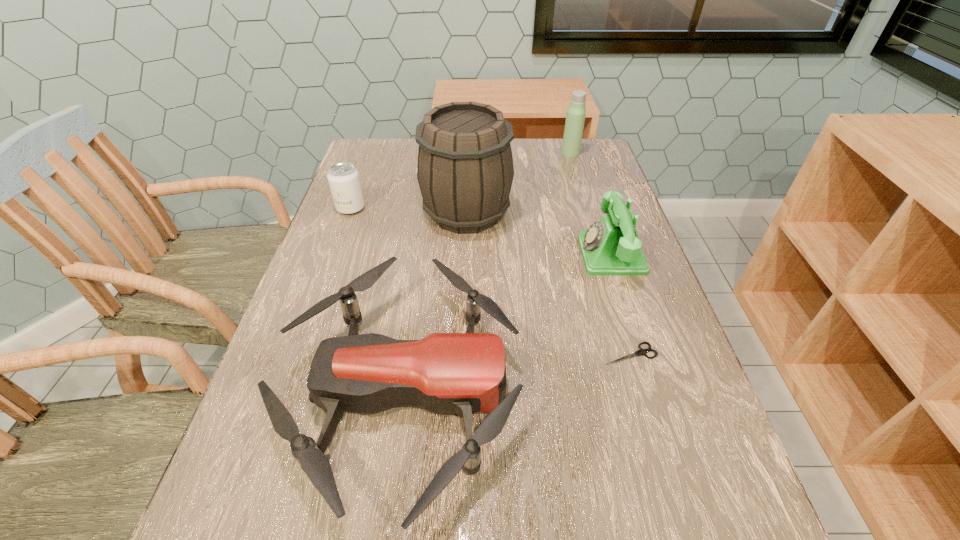
Locate an element on the screen. This screenshot has width=960, height=540. wine bucket is located at coordinates (465, 171).

Where is `the fifth shortest object`? This screenshot has height=540, width=960. the fifth shortest object is located at coordinates (575, 117).

The image size is (960, 540). In order to click on thermos bottle in this screenshot , I will do `click(575, 117)`.

At what (x,y) coordinates should I click in order to perform the action: click on telephone. Please return your answer as a coordinate pair (x, y). Image resolution: width=960 pixels, height=540 pixels. Looking at the image, I should click on (610, 246).

Where is `soda can`? Image resolution: width=960 pixels, height=540 pixels. soda can is located at coordinates (344, 181).

At what (x,y) coordinates should I click in order to perform the action: click on the shortest object. Please return your answer as a coordinate pair (x, y). The height and width of the screenshot is (540, 960). Looking at the image, I should click on pos(641,351).

Find the location of a particular element. The image size is (960, 540). free space located on the back of the wine bucket is located at coordinates (468, 161).

The height and width of the screenshot is (540, 960). Identify the location of vacant space situated on the left of the farthest object. click(511, 153).

This screenshot has width=960, height=540. In order to click on vacant space located on the dial of the telephone in this screenshot , I will do pos(433,255).

You are a GUI agent. You are given a task and a screenshot of the screen. Output one action in this format:
    pyautogui.click(x=<x>, y=<y>)
    Task: Click on the free space located on the dial of the telephone
    The image size is (960, 540).
    Given the screenshot: What is the action you would take?
    pyautogui.click(x=454, y=255)